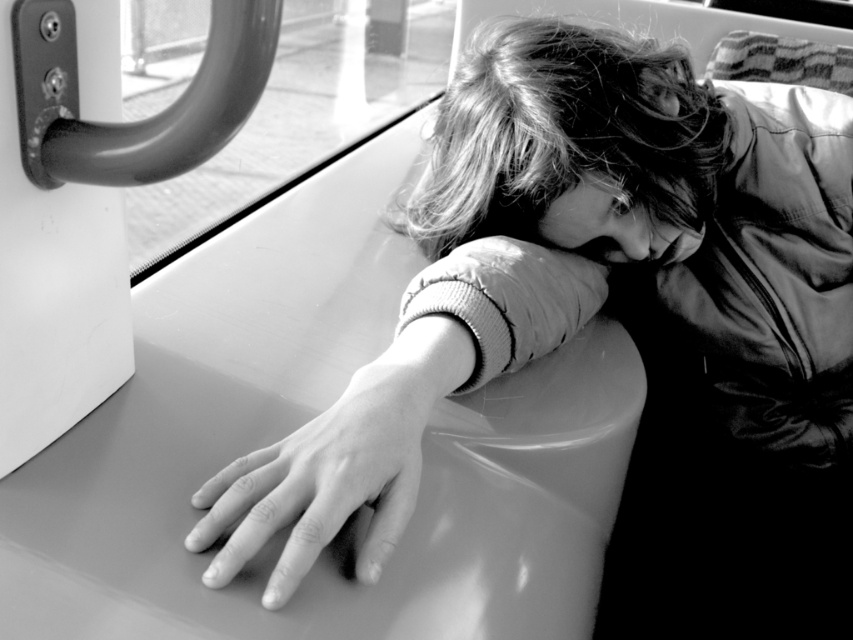
Is smooth leather jacket at center further to camera compared to smooth leather arm at center?

That is True.

Between smooth leather jacket at center and smooth leather arm at center, which one is positioned higher?

Positioned higher is smooth leather jacket at center.

Does point (799, 216) lie behind point (265, 474)?

Yes, point (799, 216) is behind point (265, 474).

Where is `smooth leather jacket at center`? The image size is (853, 640). smooth leather jacket at center is located at coordinates (585, 269).

Who is taller, smooth leather arm at center or transparent glass window at upper left?

Standing taller between the two is transparent glass window at upper left.

Which is behind, point (263, 516) or point (299, 128)?

Point (299, 128)

What are the coordinates of `smooth leather arm at center` in the screenshot? It's located at (393, 410).

Does smooth leather jacket at center appear under transparent glass window at upper left?

Answer: Yes.

The image size is (853, 640). Find the location of `smooth leather jacket at center`. smooth leather jacket at center is located at coordinates (585, 269).

I want to click on smooth leather jacket at center, so click(x=585, y=269).